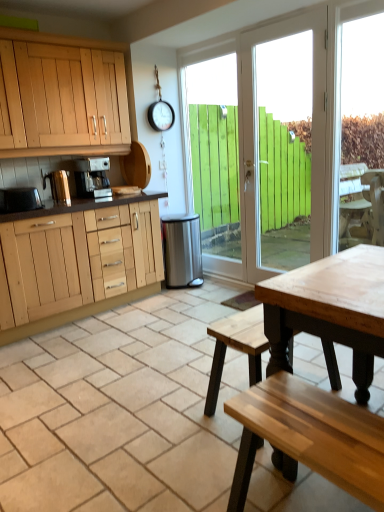
Question: Is brushed metal kettle at left, arranged as the second appliance when viewed from the back, in contact with metallic silver toaster at left, the third appliance when ordered from right to left?

Choices:
 (A) no
 (B) yes

Answer: (A)

Question: Can you confirm if brushed metal kettle at left, arranged as the second appliance when viewed from the back, is taller than metallic silver toaster at left, acting as the 3th appliance starting from the back?

Choices:
 (A) yes
 (B) no

Answer: (A)

Question: Is brushed metal kettle at left, the 2th appliance viewed from the front, not near metallic silver toaster at left, arranged as the 1th appliance when viewed from the front?

Choices:
 (A) yes
 (B) no

Answer: (B)

Question: Does brushed metal kettle at left, the 2th appliance viewed from the front, have a lesser height compared to metallic silver toaster at left, the 1th appliance viewed from the left?

Choices:
 (A) no
 (B) yes

Answer: (A)

Question: From a real-world perspective, is brushed metal kettle at left, which is the 2th appliance from left to right, physically below metallic silver toaster at left, acting as the 3th appliance starting from the back?

Choices:
 (A) yes
 (B) no

Answer: (B)

Question: Is point (188, 245) closer or farther from the camera than point (1, 201)?

Choices:
 (A) closer
 (B) farther

Answer: (B)

Question: Would you say stainless steel trash can at center, which ranks as the first appliance in back-to-front order, is to the left or to the right of metallic silver toaster at left, the third appliance when ordered from right to left, in the picture?

Choices:
 (A) left
 (B) right

Answer: (B)

Question: From a real-world perspective, relative to metallic silver toaster at left, the 1th appliance viewed from the left, is stainless steel trash can at center, which ranks as the first appliance in back-to-front order, vertically above or below?

Choices:
 (A) below
 (B) above

Answer: (A)

Question: Is stainless steel trash can at center, the 3th appliance from the left, in front of or behind metallic silver toaster at left, acting as the 3th appliance starting from the back, in the image?

Choices:
 (A) behind
 (B) front

Answer: (A)

Question: In the image, is satin silver coffee maker at center on the left side or the right side of white wood door at center?

Choices:
 (A) right
 (B) left

Answer: (B)

Question: Is satin silver coffee maker at center inside or outside of white wood door at center?

Choices:
 (A) outside
 (B) inside

Answer: (A)

Question: Considering the positions of point (92, 175) and point (263, 50), is point (92, 175) closer or farther from the camera than point (263, 50)?

Choices:
 (A) farther
 (B) closer

Answer: (B)

Question: From a real-world perspective, is satin silver coffee maker at center positioned above or below white wood door at center?

Choices:
 (A) below
 (B) above

Answer: (B)

Question: From the image's perspective, is stainless steel trash can at center, which ranks as the third appliance in front-to-back order, positioned above or below white wood door at center?

Choices:
 (A) below
 (B) above

Answer: (A)

Question: Would you say stainless steel trash can at center, which is the first appliance from right to left, is to the left or to the right of white wood door at center in the picture?

Choices:
 (A) right
 (B) left

Answer: (B)